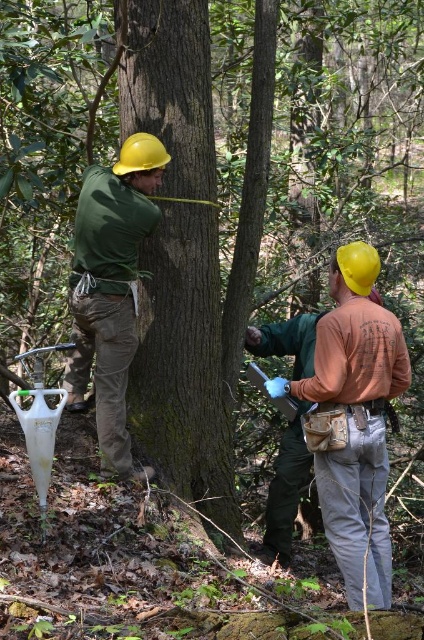
Question: In this image, where is smooth brown tree trunk at center located relative to orange fabric shirt at right?

Choices:
 (A) left
 (B) right

Answer: (A)

Question: Which point appears farthest from the camera in this image?

Choices:
 (A) (379, 419)
 (B) (117, 186)

Answer: (B)

Question: Observing the image, what is the correct spatial positioning of smooth brown tree trunk at center in reference to orange fabric shirt at right?

Choices:
 (A) below
 (B) above

Answer: (B)

Question: Considering the real-world distances, which object is closest to the matte green shirt at center?

Choices:
 (A) orange fabric shirt at right
 (B) smooth brown tree trunk at center

Answer: (B)

Question: Is smooth brown tree trunk at center thinner than orange fabric shirt at right?

Choices:
 (A) yes
 (B) no

Answer: (B)

Question: Which point is farther from the camera taking this photo?

Choices:
 (A) (137, 177)
 (B) (340, 378)

Answer: (A)